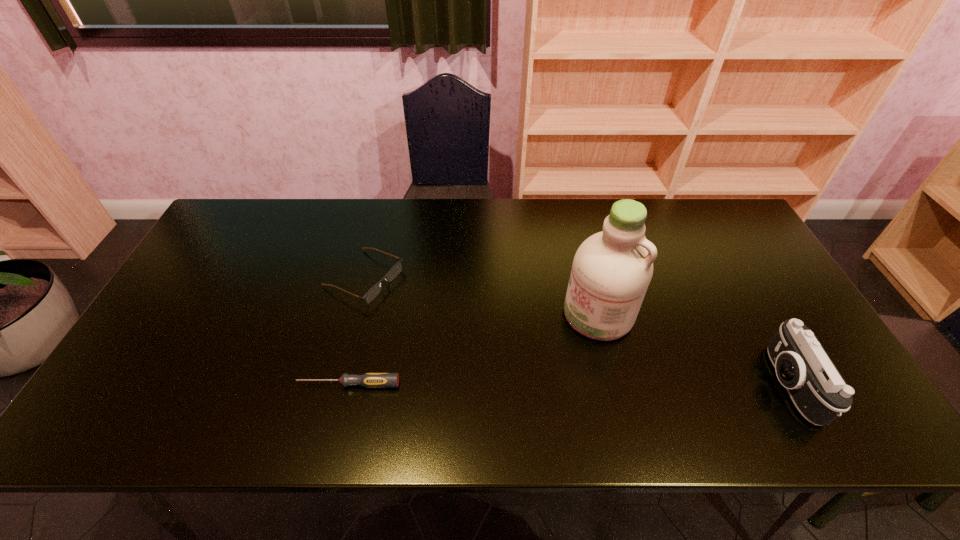
The image size is (960, 540). What are the coordinates of `vacant space on the desktop that is between the shortest object and the rightmost object and is positioned on the front-facing side of the spectacles` in the screenshot? It's located at (593, 384).

The height and width of the screenshot is (540, 960). I want to click on vacant space on the desktop that is between the shortest object and the rightmost object and is positioned on the front label of the third object from left to right, so click(513, 384).